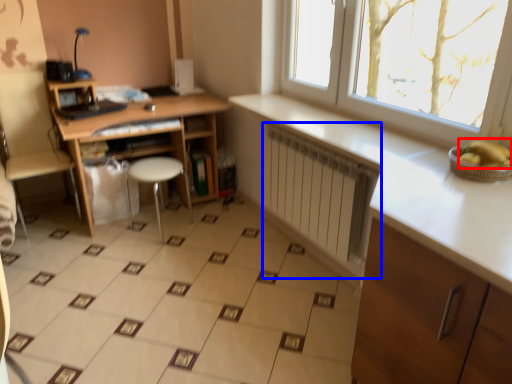
Question: Which object is closer to the camera taking this photo, banana (highlighted by a red box) or radiator (highlighted by a blue box)?

Choices:
 (A) banana
 (B) radiator

Answer: (A)